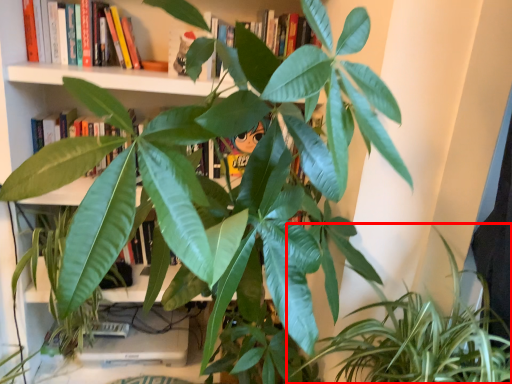
Question: From the image's perspective, where is houseplant (annotated by the red box) located in relation to book in the image?

Choices:
 (A) below
 (B) above

Answer: (A)